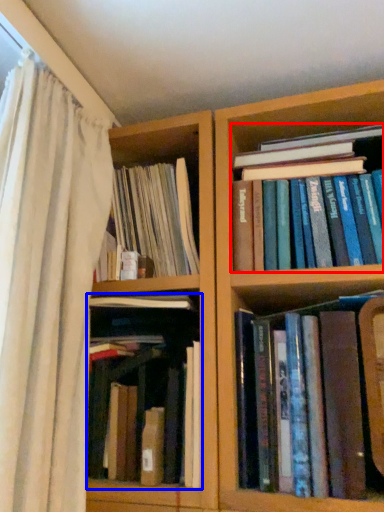
Question: Among these objects, which one is farthest to the camera, book (highlighted by a red box) or book (highlighted by a blue box)?

Choices:
 (A) book
 (B) book

Answer: (A)